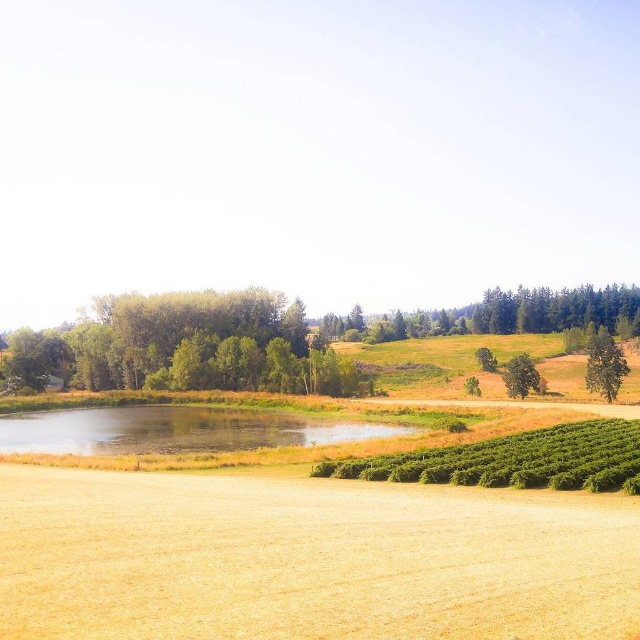
You are standing at the camera position looking at the landscape. There are two points marked in the image, one at coordinates point (369, 426) and the other at point (586, 381). Which point is closer to you?

Point (369, 426) is closer to the camera than point (586, 381).